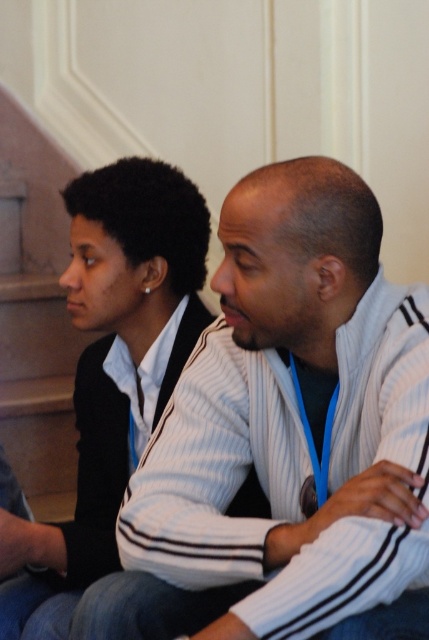
Question: Among these objects, which one is nearest to the camera?

Choices:
 (A) matte white sweater at center
 (B) white striped sweater at center

Answer: (B)

Question: Does white striped sweater at center lie in front of matte white sweater at center?

Choices:
 (A) yes
 (B) no

Answer: (A)

Question: Is white striped sweater at center to the left of matte white sweater at center from the viewer's perspective?

Choices:
 (A) no
 (B) yes

Answer: (A)

Question: Which object is closer to the camera taking this photo?

Choices:
 (A) white striped sweater at center
 (B) matte white sweater at center

Answer: (A)

Question: Can you confirm if white striped sweater at center is positioned to the right of matte white sweater at center?

Choices:
 (A) no
 (B) yes

Answer: (B)

Question: Which point is farther to the camera?

Choices:
 (A) matte white sweater at center
 (B) white striped sweater at center

Answer: (A)